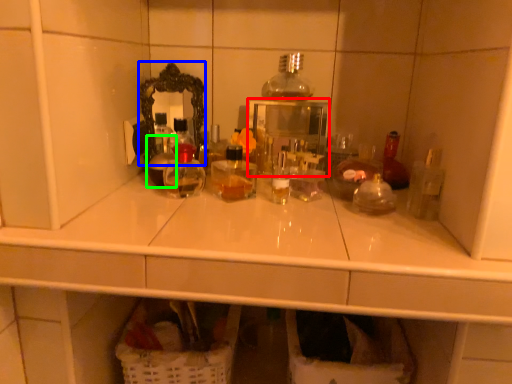
Question: Estimate the real-world distances between objects in this image. Which object is closer to medicine cabinet (highlighted by a red box), mirror (highlighted by a blue box) or bottle (highlighted by a green box)?

Choices:
 (A) mirror
 (B) bottle

Answer: (A)